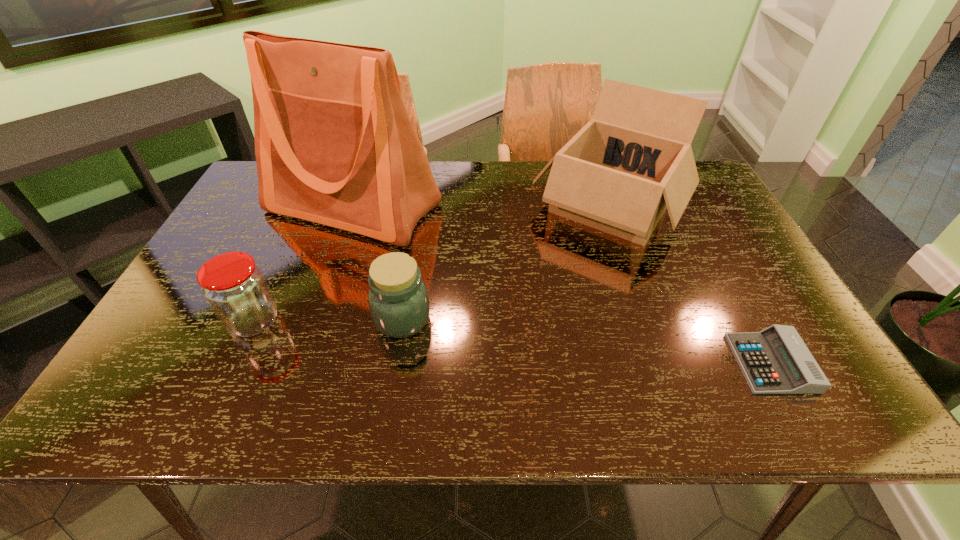
Identify the location of blank region between the left jar and the box. (432, 264).

Identify the location of free area in between the second tallest object and the shortest object. Image resolution: width=960 pixels, height=540 pixels. (690, 285).

You are a GUI agent. You are given a task and a screenshot of the screen. Output one action in this format:
    pyautogui.click(x=<x>, y=<y>)
    Task: Click on the empty space between the left jar and the second tallest object
    
    Given the screenshot: What is the action you would take?
    pyautogui.click(x=432, y=264)

Find the location of `free spot between the left jar and the box`. free spot between the left jar and the box is located at coordinates (432, 264).

The height and width of the screenshot is (540, 960). Find the location of `free space between the right jar and the left jar`. free space between the right jar and the left jar is located at coordinates (328, 320).

Where is `vacant area that lies between the calculator and the fourth shortest object`? vacant area that lies between the calculator and the fourth shortest object is located at coordinates (690, 285).

Identify the location of object that is the third closest to the right jar. (633, 159).

Locate which object ranks in proximity to the box. Please provide its 2D coordinates. Your answer should be formatted as a tuple, i.e. [(x, y)], where the tuple contains the x and y coordinates of a point satisfying the conditions above.

[(776, 360)]

The height and width of the screenshot is (540, 960). I want to click on free space that satisfies the following two spatial constraints: 1. on the front side of the calculator; 2. on the left side of the right jar, so click(x=396, y=363).

At what (x,y) coordinates should I click in order to perform the action: click on vacant space that satisfies the following two spatial constraints: 1. on the back side of the left jar; 2. on the right side of the second tallest object. Please return your answer as a coordinate pair (x, y). This screenshot has width=960, height=540. Looking at the image, I should click on (308, 206).